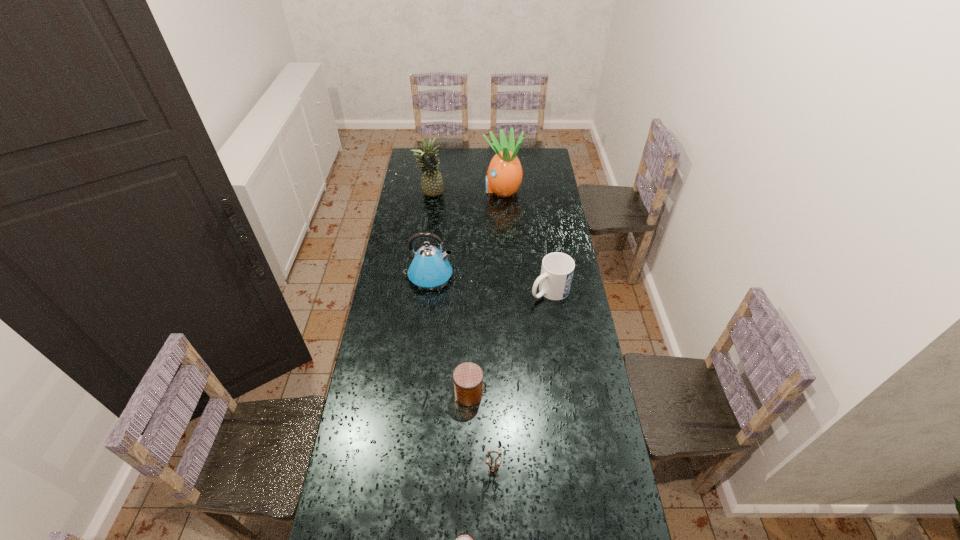
Locate an element on the screen. The image size is (960, 540). the right pineapple is located at coordinates (504, 176).

At what (x,y) coordinates should I click in order to perform the action: click on the left pineapple. Please return your answer as a coordinate pair (x, y). Looking at the image, I should click on (432, 183).

Find the location of `kettle`. kettle is located at coordinates (429, 268).

Where is `mug`? This screenshot has width=960, height=540. mug is located at coordinates (557, 270).

The width and height of the screenshot is (960, 540). Find the location of `jar`. jar is located at coordinates (467, 377).

Identify the location of the sixth farthest object. Image resolution: width=960 pixels, height=540 pixels. (493, 468).

At what (x,y) coordinates should I click in order to perform the action: click on free location located at the entrance of the right pineapple. Please return your answer as a coordinate pair (x, y). This screenshot has width=960, height=540. Looking at the image, I should click on coord(450,190).

The image size is (960, 540). What are the coordinates of `vacant space located at the entrance of the right pineapple` in the screenshot? It's located at (433, 190).

Image resolution: width=960 pixels, height=540 pixels. Find the location of `free space located at the entrance of the right pineapple`. free space located at the entrance of the right pineapple is located at coordinates pos(467,190).

This screenshot has width=960, height=540. I want to click on free location located 0.070m on the front of the left pineapple, so click(x=428, y=211).